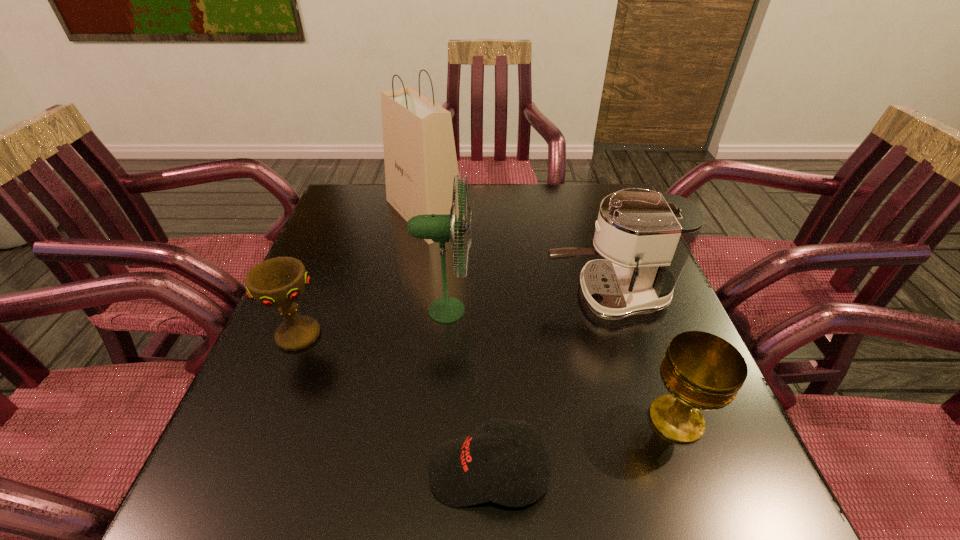
Image resolution: width=960 pixels, height=540 pixels. Find the location of `shopping bag at the left edge`. shopping bag at the left edge is located at coordinates (420, 159).

I want to click on chalice that is at the left edge, so click(279, 282).

The height and width of the screenshot is (540, 960). What are the coordinates of `coffee maker at the right edge` in the screenshot? It's located at (646, 237).

Locate an element on the screen. The image size is (960, 540). chalice that is at the right edge is located at coordinates (701, 371).

In order to click on object that is at the far left corner in this screenshot , I will do `click(420, 159)`.

What are the coordinates of `vacant space at the far edge of the desktop` in the screenshot? It's located at (577, 220).

Where is `free space at the near edge of the desktop`? The width and height of the screenshot is (960, 540). free space at the near edge of the desktop is located at coordinates [375, 525].

Identify the location of vacant space at the left edge of the desktop. Image resolution: width=960 pixels, height=540 pixels. (348, 263).

The width and height of the screenshot is (960, 540). Identify the location of vacant region at the right edge of the desktop. (681, 448).

Identify the location of free space at the far left corner of the desktop. (357, 205).